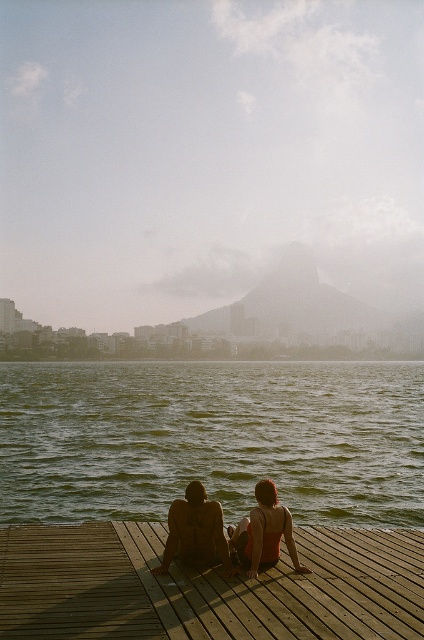
Question: Can you confirm if green water at center is positioned to the right of matte skin couple at center?

Choices:
 (A) yes
 (B) no

Answer: (B)

Question: Which object is farther from the camera taking this photo?

Choices:
 (A) wooden at lower center
 (B) green water at center
 (C) matte skin couple at center

Answer: (B)

Question: Considering the real-world distances, which object is farthest from the wooden at lower center?

Choices:
 (A) matte skin couple at center
 (B) green water at center

Answer: (B)

Question: Which of the following is the farthest from the observer?

Choices:
 (A) (172, 516)
 (B) (30, 474)
 (C) (47, 531)

Answer: (B)

Question: Does green water at center have a greater width compared to matte skin couple at center?

Choices:
 (A) yes
 (B) no

Answer: (A)

Question: In this image, where is green water at center located relative to matte skin couple at center?

Choices:
 (A) left
 (B) right

Answer: (A)